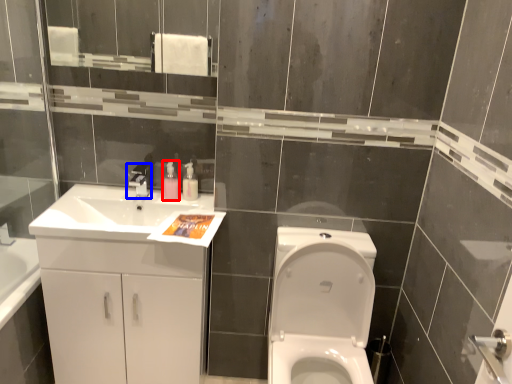
Question: Which of the following is the farthest to the observer, soap dispenser (highlighted by a red box) or tap (highlighted by a blue box)?

Choices:
 (A) soap dispenser
 (B) tap

Answer: (A)